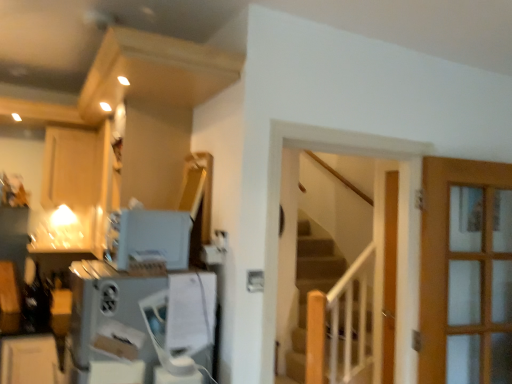
Image resolution: width=512 pixels, height=384 pixels. What do you see at coordinates (143, 302) in the screenshot? I see `satin silver appliance at lower left, the 1th appliance from the bottom` at bounding box center [143, 302].

Describe the element at coordinates (148, 238) in the screenshot. I see `satin white toaster at upper center, arranged as the 1th appliance when viewed from the top` at that location.

The height and width of the screenshot is (384, 512). What do you see at coordinates (72, 167) in the screenshot?
I see `matte wood cabinet at upper left` at bounding box center [72, 167].

Find the location of `wooden stairs at center`. wooden stairs at center is located at coordinates (309, 290).

This screenshot has width=512, height=384. Identify the location of satin silver appliance at lower left, which appears as the second appliance when viewed from the top. (143, 302).

From their relative heights in the image, would you say wooden stairs at center is taller or shorter than satin white toaster at upper center, which ranks as the second appliance in bottom-to-top order?

Considering their sizes, wooden stairs at center has more height than satin white toaster at upper center, which ranks as the second appliance in bottom-to-top order.

Does point (281, 381) appear closer or farther from the camera than point (167, 214)?

Point (281, 381) is farther from the camera than point (167, 214).

Is wooden stairs at center in contact with satin white toaster at upper center, arranged as the 1th appliance when viewed from the top?

wooden stairs at center and satin white toaster at upper center, arranged as the 1th appliance when viewed from the top, are clearly separated.

Is wooden stairs at center to the left of satin white toaster at upper center, arranged as the 1th appliance when viewed from the top, from the viewer's perspective?

In fact, wooden stairs at center is to the right of satin white toaster at upper center, arranged as the 1th appliance when viewed from the top.

Which is correct: satin silver appliance at lower left, the 1th appliance from the bottom, is inside satin white toaster at upper center, arranged as the 1th appliance when viewed from the top, or outside of it?

The correct answer is: outside.

From the image's perspective, which is below, satin silver appliance at lower left, the 1th appliance from the bottom, or satin white toaster at upper center, which ranks as the second appliance in bottom-to-top order?

satin silver appliance at lower left, the 1th appliance from the bottom, from the image's perspective.

Between satin silver appliance at lower left, which appears as the second appliance when viewed from the top, and satin white toaster at upper center, arranged as the 1th appliance when viewed from the top, which one is positioned behind?

satin white toaster at upper center, arranged as the 1th appliance when viewed from the top, is more distant.

Is satin white toaster at upper center, arranged as the 1th appliance when viewed from the top, aimed at matte wood cabinet at upper left?

No, satin white toaster at upper center, arranged as the 1th appliance when viewed from the top, is not oriented towards matte wood cabinet at upper left.

Based on their positions, is satin white toaster at upper center, arranged as the 1th appliance when viewed from the top, located to the left or right of matte wood cabinet at upper left?

In the image, satin white toaster at upper center, arranged as the 1th appliance when viewed from the top, appears on the right side of matte wood cabinet at upper left.

Between satin white toaster at upper center, which ranks as the second appliance in bottom-to-top order, and matte wood cabinet at upper left, which one has larger size?

matte wood cabinet at upper left.

Is satin silver appliance at lower left, the 1th appliance from the bottom, surrounded by matte wood cabinet at upper left?

Actually, satin silver appliance at lower left, the 1th appliance from the bottom, is outside matte wood cabinet at upper left.

Looking at this image, is matte wood cabinet at upper left next to satin silver appliance at lower left, which appears as the second appliance when viewed from the top?

They are not placed beside each other.

In the scene shown: Which of these two, matte wood cabinet at upper left or satin silver appliance at lower left, which appears as the second appliance when viewed from the top, stands taller?

Standing taller between the two is satin silver appliance at lower left, which appears as the second appliance when viewed from the top.

Which is behind, matte wood cabinet at upper left or satin silver appliance at lower left, which appears as the second appliance when viewed from the top?

matte wood cabinet at upper left is further from the camera.

Is matte wood cabinet at upper left wider or thinner than satin white toaster at upper center, arranged as the 1th appliance when viewed from the top?

Considering their sizes, matte wood cabinet at upper left looks broader than satin white toaster at upper center, arranged as the 1th appliance when viewed from the top.

Which of these two, matte wood cabinet at upper left or satin white toaster at upper center, which ranks as the second appliance in bottom-to-top order, stands taller?

matte wood cabinet at upper left.

Between matte wood cabinet at upper left and satin white toaster at upper center, which ranks as the second appliance in bottom-to-top order, which one is positioned behind?

matte wood cabinet at upper left is more distant.

Looking at this image, from a real-world perspective, which object stands above the other?

From a 3D spatial view, matte wood cabinet at upper left is above.

Which is more to the right, satin white toaster at upper center, arranged as the 1th appliance when viewed from the top, or satin silver appliance at lower left, the 1th appliance from the bottom?

satin white toaster at upper center, arranged as the 1th appliance when viewed from the top, is more to the right.

Find the location of `appliance behind the satin silver appliance at lower left, the 1th appliance from the bottom`. appliance behind the satin silver appliance at lower left, the 1th appliance from the bottom is located at coordinates (148, 238).

Is satin white toaster at upper center, arranged as the 1th appliance when viewed from the top, outside of satin silver appliance at lower left, the 1th appliance from the bottom?

Yes, satin white toaster at upper center, arranged as the 1th appliance when viewed from the top, is not within satin silver appliance at lower left, the 1th appliance from the bottom.

Is point (175, 224) less distant than point (149, 377)?

No, (175, 224) is further to viewer.

From the image's perspective, is wooden stairs at center located above matte wood cabinet at upper left?

No, from the image's perspective, wooden stairs at center is not over matte wood cabinet at upper left.

Could you tell me if wooden stairs at center is facing matte wood cabinet at upper left?

No, wooden stairs at center is not aimed at matte wood cabinet at upper left.

Looking at the image, does wooden stairs at center seem bigger or smaller compared to matte wood cabinet at upper left?

In the image, wooden stairs at center appears to be larger than matte wood cabinet at upper left.

How many degrees apart are the facing directions of wooden stairs at center and matte wood cabinet at upper left?

171 degrees separate the facing orientations of wooden stairs at center and matte wood cabinet at upper left.

Locate an element on the screen. stairs to the right of satin white toaster at upper center, which ranks as the second appliance in bottom-to-top order is located at coordinates (309, 290).

In the image, there is a satin white toaster at upper center, arranged as the 1th appliance when viewed from the top. Find the location of `appliance below it (from the image's perspective)`. appliance below it (from the image's perspective) is located at coordinates click(x=143, y=302).

From the image, which object appears to be farther from satin silver appliance at lower left, which appears as the second appliance when viewed from the top, matte wood cabinet at upper left or satin white toaster at upper center, which ranks as the second appliance in bottom-to-top order?

Based on the image, matte wood cabinet at upper left appears to be further to satin silver appliance at lower left, which appears as the second appliance when viewed from the top.

Considering their positions, is satin silver appliance at lower left, which appears as the second appliance when viewed from the top, positioned closer to wooden stairs at center than satin white toaster at upper center, arranged as the 1th appliance when viewed from the top?

satin silver appliance at lower left, which appears as the second appliance when viewed from the top.

Based on their spatial positions, is satin silver appliance at lower left, the 1th appliance from the bottom, or wooden stairs at center closer to matte wood cabinet at upper left?

satin silver appliance at lower left, the 1th appliance from the bottom, is positioned closer to the anchor matte wood cabinet at upper left.

Looking at the image, which one is located closer to wooden stairs at center, matte wood cabinet at upper left or satin white toaster at upper center, arranged as the 1th appliance when viewed from the top?

matte wood cabinet at upper left lies closer to wooden stairs at center than the other object.

Based on their spatial positions, is satin silver appliance at lower left, the 1th appliance from the bottom, or wooden stairs at center closer to satin white toaster at upper center, arranged as the 1th appliance when viewed from the top?

satin silver appliance at lower left, the 1th appliance from the bottom, is positioned closer to the anchor satin white toaster at upper center, arranged as the 1th appliance when viewed from the top.

Considering their positions, is matte wood cabinet at upper left positioned closer to satin white toaster at upper center, arranged as the 1th appliance when viewed from the top, than satin silver appliance at lower left, which appears as the second appliance when viewed from the top?

satin silver appliance at lower left, which appears as the second appliance when viewed from the top.

Which object lies further to the anchor point matte wood cabinet at upper left, wooden stairs at center or satin silver appliance at lower left, the 1th appliance from the bottom?

wooden stairs at center lies further to matte wood cabinet at upper left than the other object.

Based on their spatial positions, is satin white toaster at upper center, arranged as the 1th appliance when viewed from the top, or satin silver appliance at lower left, which appears as the second appliance when viewed from the top, further from wooden stairs at center?

satin white toaster at upper center, arranged as the 1th appliance when viewed from the top, lies further to wooden stairs at center than the other object.

Where is `appliance between satin silver appliance at lower left, which appears as the second appliance when viewed from the top, and matte wood cabinet at upper left, along the z-axis`? appliance between satin silver appliance at lower left, which appears as the second appliance when viewed from the top, and matte wood cabinet at upper left, along the z-axis is located at coordinates (148, 238).

The width and height of the screenshot is (512, 384). In order to click on appliance located between satin silver appliance at lower left, the 1th appliance from the bottom, and wooden stairs at center in the depth direction in this screenshot , I will do `click(148, 238)`.